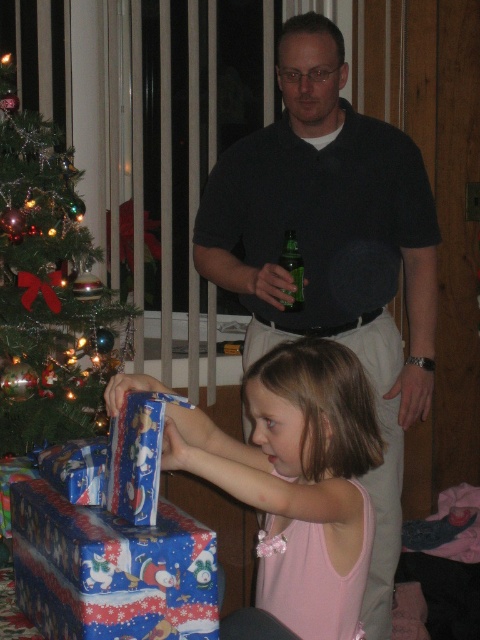
You are a delivery robot that needs to place a new gift on the matte blue wrapping paper at lower center. The gift must be placed exactly at the point with coordinates (x=297, y=472). Can you confirm if this point is located on the matte blue wrapping paper at lower center?

Yes, the point (x=297, y=472) is located on the matte blue wrapping paper at lower center as stated in the description.